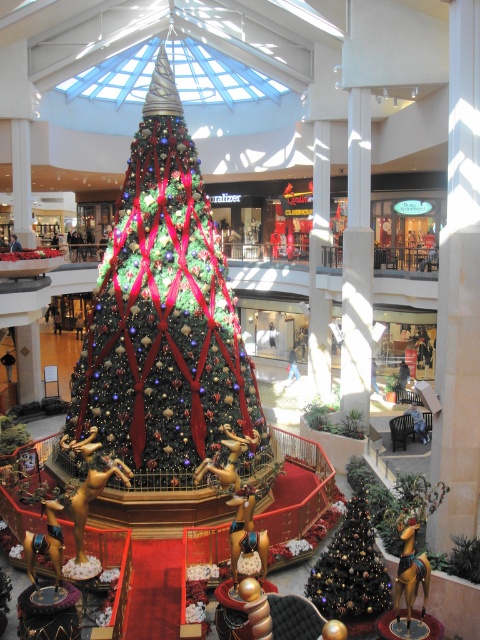
You are a store manager planning to place a new 1.5 meter wide promotional stand in the mall. You want to place it near the shiny gold christmas tree at lower right without blocking the view of the shiny green and red ribbons at center. Considering their widths, which object should you position the stand closer to?

The shiny green and red ribbons at center are wider than the shiny gold christmas tree at lower right. To avoid blocking the view of the ribbons, position the stand closer to the shiny gold christmas tree at lower right since it has a narrower width.

You are standing at point (x=383, y=564) and want to walk to the Christmas tree at the center of the mall. Is the point (x=229, y=292) located behind you or in front of you relative to your direction of movement towards the Christmas tree?

The point (x=229, y=292) is behind point (x=383, y=564), so if you are facing towards the Christmas tree at the center of the mall, the point (x=229, y=292) would be behind you relative to your direction of movement.

Based on the photo, you are a photographer standing in the mall and want to capture the shiny green and red ribbons at center and the shiny gold christmas tree at lower right in the same frame. Which object should you focus on first if you want the other to appear smaller in the background?

You should focus on the shiny gold christmas tree at lower right first because the shiny green and red ribbons at center are positioned over it, making the tree appear smaller in the background.